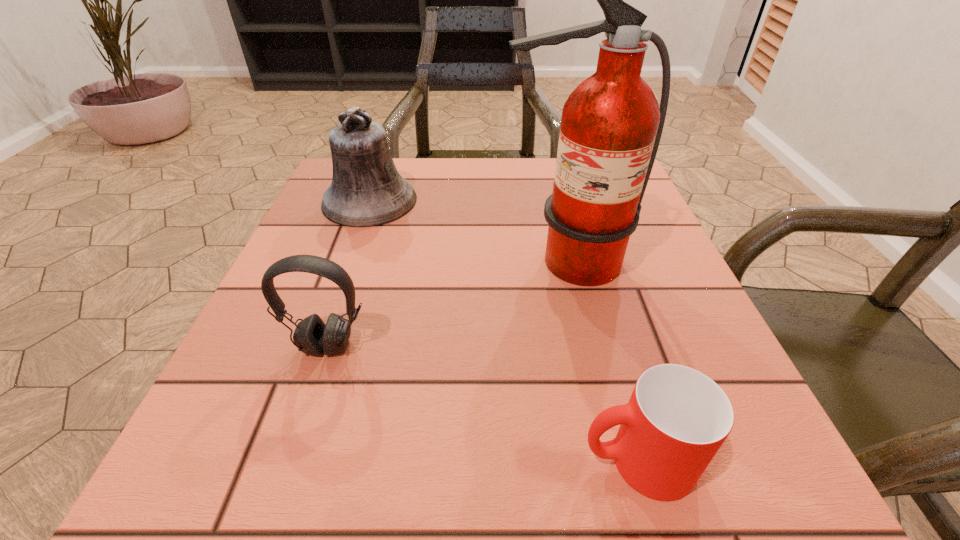
Where is `vacant space that satisfies the following two spatial constraints: 1. on the side of the nearest object with the handle; 2. on the front side of the farthest object`? vacant space that satisfies the following two spatial constraints: 1. on the side of the nearest object with the handle; 2. on the front side of the farthest object is located at coordinates (565, 201).

Find the location of a particular element. Image resolution: width=960 pixels, height=540 pixels. free space that satisfies the following two spatial constraints: 1. on the side of the cup with the handle; 2. on the front-facing side of the headset is located at coordinates (606, 346).

The image size is (960, 540). I want to click on blank space that satisfies the following two spatial constraints: 1. on the side of the nearest object with the handle; 2. on the front side of the second tallest object, so click(565, 201).

At what (x,y) coordinates should I click in order to perform the action: click on vacant region that satisfies the following two spatial constraints: 1. on the side of the cup with the handle; 2. on the front-facing side of the headset. Please return your answer as a coordinate pair (x, y). This screenshot has height=540, width=960. Looking at the image, I should click on (606, 346).

What are the coordinates of `blank space that satisfies the following two spatial constraints: 1. on the front-facing side of the headset; 2. on the side of the shortest object with the handle` in the screenshot? It's located at (289, 461).

What are the coordinates of `vacant space that satisfies the following two spatial constraints: 1. on the side of the nearest object with the handle; 2. on the nozzle and handle of the second farthest object` in the screenshot? It's located at (582, 262).